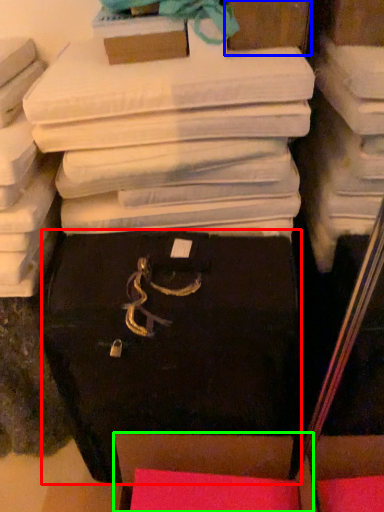
Question: Based on their relative distances, which object is nearer to storage box (highlighted by a red box)? Choose from storage box (highlighted by a blue box) and storage box (highlighted by a green box).

Choices:
 (A) storage box
 (B) storage box

Answer: (B)